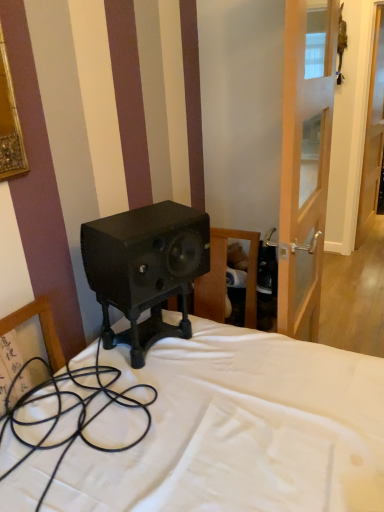
Question: From a real-world perspective, is transparent glass door at right positioned under black rubber cable at lower left based on gravity?

Choices:
 (A) yes
 (B) no

Answer: (B)

Question: Does transparent glass door at right have a lesser width compared to black rubber cable at lower left?

Choices:
 (A) no
 (B) yes

Answer: (B)

Question: Is transparent glass door at right turned away from black rubber cable at lower left?

Choices:
 (A) yes
 (B) no

Answer: (B)

Question: Is transparent glass door at right bigger than black rubber cable at lower left?

Choices:
 (A) no
 (B) yes

Answer: (A)

Question: From the image's perspective, is transparent glass door at right located above black rubber cable at lower left?

Choices:
 (A) no
 (B) yes

Answer: (B)

Question: From a real-world perspective, is transparent glass door at right over black rubber cable at lower left?

Choices:
 (A) yes
 (B) no

Answer: (A)

Question: Considering the relative positions of matte black speaker at center and black rubber cable at lower left in the image provided, is matte black speaker at center to the left of black rubber cable at lower left from the viewer's perspective?

Choices:
 (A) no
 (B) yes

Answer: (A)

Question: Could black rubber cable at lower left be considered to be inside matte black speaker at center?

Choices:
 (A) no
 (B) yes

Answer: (A)

Question: Is matte black speaker at center oriented towards black rubber cable at lower left?

Choices:
 (A) no
 (B) yes

Answer: (A)

Question: Is matte black speaker at center looking in the opposite direction of black rubber cable at lower left?

Choices:
 (A) yes
 (B) no

Answer: (B)

Question: From the image's perspective, is matte black speaker at center beneath black rubber cable at lower left?

Choices:
 (A) yes
 (B) no

Answer: (B)

Question: Is matte black speaker at center shorter than black rubber cable at lower left?

Choices:
 (A) no
 (B) yes

Answer: (B)

Question: Is matte black speaker at center oriented away from transparent glass door at right?

Choices:
 (A) yes
 (B) no

Answer: (B)